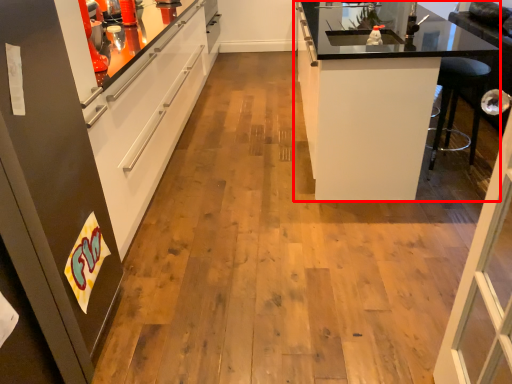
Question: From the image's perspective, what is the correct spatial positioning of cabinetry (annotated by the red box) in reference to cabinetry?

Choices:
 (A) above
 (B) below

Answer: (A)